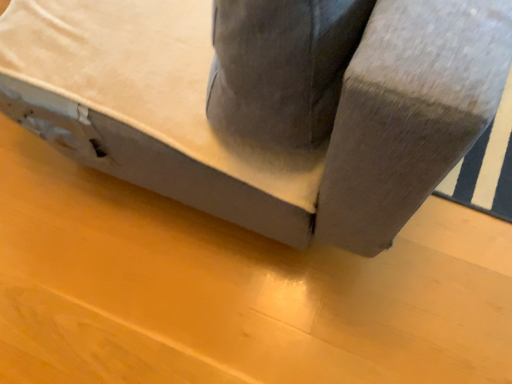
Question: Is matte gray plywood at lower center surrounding suede gray couch at center?

Choices:
 (A) no
 (B) yes

Answer: (A)

Question: From the image's perspective, would you say matte gray plywood at lower center is shown under suede gray couch at center?

Choices:
 (A) no
 (B) yes

Answer: (B)

Question: Can you confirm if matte gray plywood at lower center is thinner than suede gray couch at center?

Choices:
 (A) no
 (B) yes

Answer: (A)

Question: From a real-world perspective, is matte gray plywood at lower center physically above suede gray couch at center?

Choices:
 (A) yes
 (B) no

Answer: (B)

Question: Would you say matte gray plywood at lower center is outside suede gray couch at center?

Choices:
 (A) yes
 (B) no

Answer: (A)

Question: From a real-world perspective, is matte gray plywood at lower center positioned under suede gray couch at center based on gravity?

Choices:
 (A) yes
 (B) no

Answer: (A)

Question: Are suede gray couch at center and matte gray plywood at lower center far apart?

Choices:
 (A) yes
 (B) no

Answer: (B)

Question: Is the position of suede gray couch at center less distant than that of matte gray plywood at lower center?

Choices:
 (A) yes
 (B) no

Answer: (A)

Question: Can you confirm if suede gray couch at center is wider than matte gray plywood at lower center?

Choices:
 (A) no
 (B) yes

Answer: (A)

Question: Considering the relative sizes of suede gray couch at center and matte gray plywood at lower center in the image provided, is suede gray couch at center bigger than matte gray plywood at lower center?

Choices:
 (A) no
 (B) yes

Answer: (B)

Question: Can you confirm if suede gray couch at center is shorter than matte gray plywood at lower center?

Choices:
 (A) no
 (B) yes

Answer: (A)

Question: Is the position of suede gray couch at center more distant than that of matte gray plywood at lower center?

Choices:
 (A) yes
 (B) no

Answer: (B)

Question: From a real-world perspective, relative to matte gray plywood at lower center, is suede gray couch at center vertically above or below?

Choices:
 (A) below
 (B) above

Answer: (B)